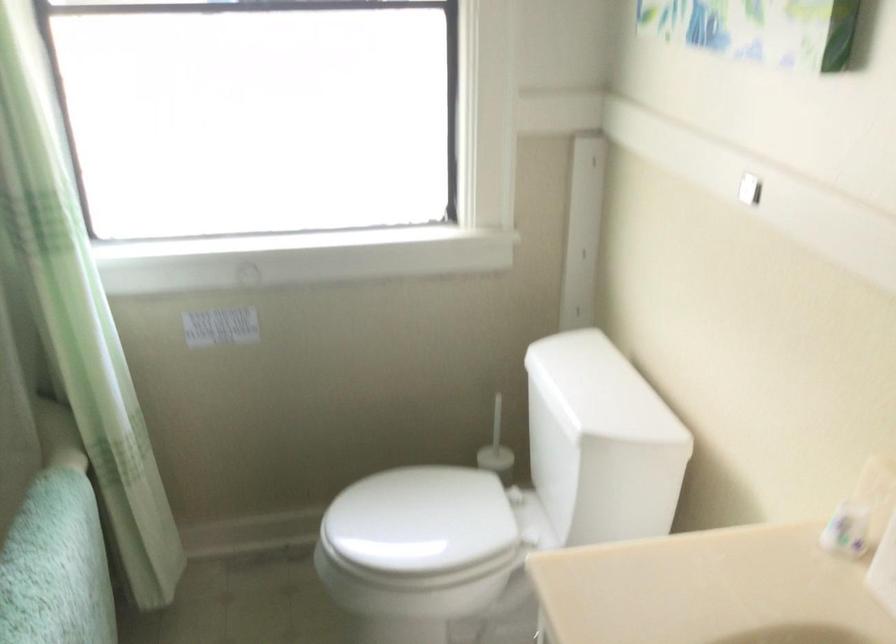
You are a GUI agent. You are given a task and a screenshot of the screen. Output one action in this format:
    pyautogui.click(x=<x>, y=<y>)
    Task: Click on the white toilet seat
    The height and width of the screenshot is (644, 896).
    Given the screenshot: What is the action you would take?
    pyautogui.click(x=419, y=526)